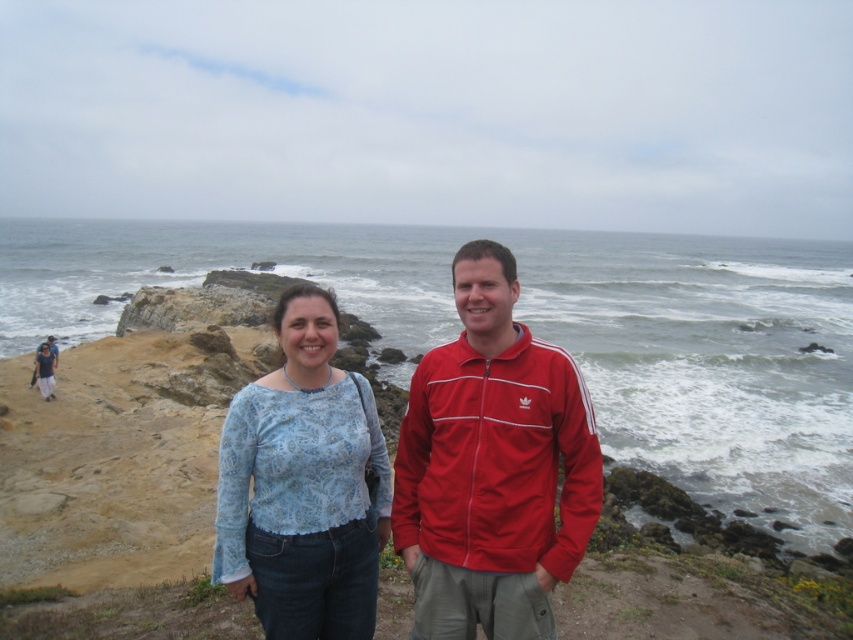
You are a photographer planning to take a group photo of the two people in the image. You want to ensure that both the white foamy water at center and the red adidas track jacket at center are clearly visible in the photo. Given their sizes, which object should you focus on to ensure both are in frame?

The white foamy water at center is larger than the red adidas track jacket at center, so focusing on the white foamy water at center will ensure both are in frame as it occupies more space in the scene.